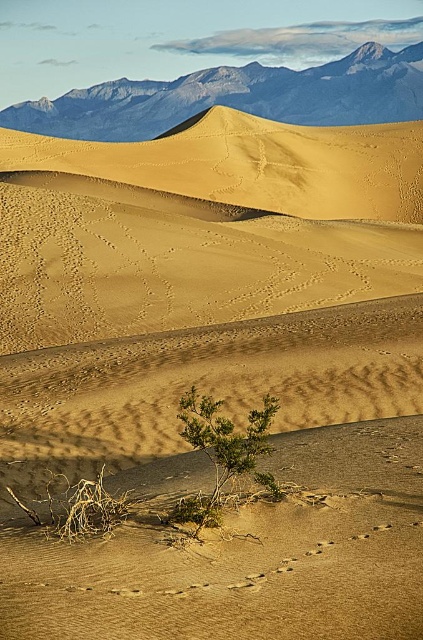
Question: Estimate the real-world distances between objects in this image. Which object is farther from the rocky gray mountain range at upper center?

Choices:
 (A) sandy yellow dune at upper center
 (B) green leafy shrub at center

Answer: (B)

Question: Can you confirm if rocky gray mountain range at upper center is bigger than green leafy shrub at center?

Choices:
 (A) yes
 (B) no

Answer: (A)

Question: Which is farther from the green leafy shrub at center?

Choices:
 (A) sandy yellow dune at upper center
 (B) rocky gray mountain range at upper center

Answer: (B)

Question: Does sandy yellow dune at upper center appear on the left side of rocky gray mountain range at upper center?

Choices:
 (A) yes
 (B) no

Answer: (B)

Question: Which is nearer to the sandy yellow dune at upper center?

Choices:
 (A) rocky gray mountain range at upper center
 (B) green leafy shrub at center

Answer: (B)

Question: From the image, what is the correct spatial relationship of sandy yellow dune at upper center in relation to green leafy shrub at center?

Choices:
 (A) above
 (B) below

Answer: (A)